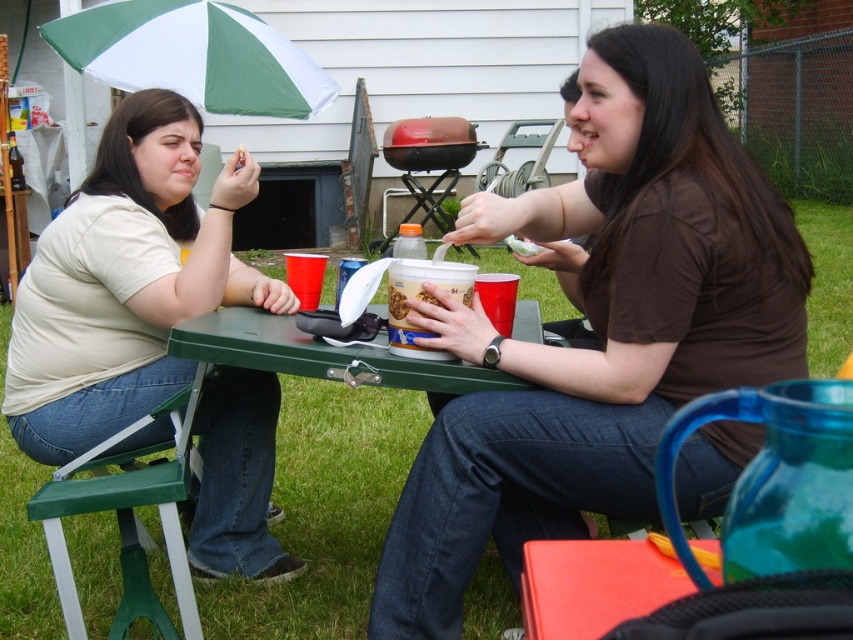
Question: Which point is closer to the camera?

Choices:
 (A) brown matte shirt at center
 (B) smooth plastic container at center
 (C) green plastic picnic table at center
 (D) matte beige shirt at left

Answer: (A)

Question: Is brown matte shirt at center positioned before green plastic stool at lower left?

Choices:
 (A) yes
 (B) no

Answer: (A)

Question: Is the position of green plastic picnic table at center less distant than that of green plastic stool at lower left?

Choices:
 (A) yes
 (B) no

Answer: (B)

Question: Is matte beige shirt at left positioned at the back of smooth plastic container at center?

Choices:
 (A) no
 (B) yes

Answer: (B)

Question: Which point is closer to the camera taking this photo?

Choices:
 (A) (102, 225)
 (B) (799, 326)
 (C) (397, 296)
 (D) (126, 509)

Answer: (B)

Question: Which of the following is the farthest from the observer?

Choices:
 (A) green plastic picnic table at center
 (B) green/white fabric umbrella at upper left

Answer: (B)